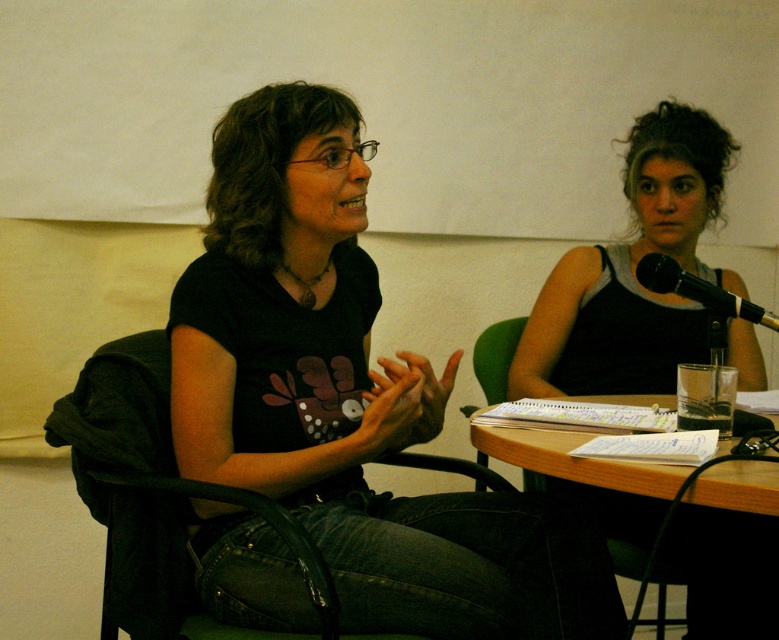
Does wooden table at lower center have a lesser height compared to black metallic microphone at upper right?

No, wooden table at lower center is not shorter than black metallic microphone at upper right.

Who is more forward, (735, 630) or (711, 285)?

Point (711, 285) is in front.

Where is `wooden table at lower center`? The height and width of the screenshot is (640, 779). wooden table at lower center is located at coordinates (728, 552).

Is black matte t-shirt at center thinner than black tank top at right?

Incorrect, black matte t-shirt at center's width is not less than black tank top at right's.

Is black matte t-shirt at center in front of black tank top at right?

Yes, black matte t-shirt at center is in front of black tank top at right.

Which is behind, point (226, 385) or point (749, 342)?

The point (749, 342) is behind.

The height and width of the screenshot is (640, 779). Find the location of `black matte t-shirt at center`. black matte t-shirt at center is located at coordinates (349, 397).

Is the position of black tank top at right more distant than that of wooden table at lower center?

Yes, black tank top at right is further from the viewer.

Between point (682, 348) and point (573, 472), which one is positioned in front?

Point (573, 472) is more forward.

Where is `black tank top at right`? black tank top at right is located at coordinates (633, 273).